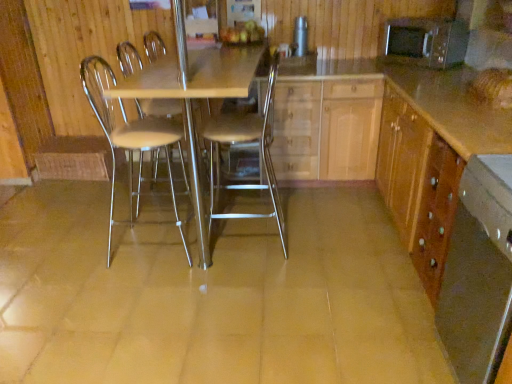
This screenshot has height=384, width=512. What do you see at coordinates (300, 37) in the screenshot?
I see `metallic cylindrical container at upper center, the second appliance in the right-to-left sequence` at bounding box center [300, 37].

The width and height of the screenshot is (512, 384). Find the location of `wooden cabinet at right, which is the 1th cabinetry from right to left`. wooden cabinet at right, which is the 1th cabinetry from right to left is located at coordinates (418, 185).

Measure the distance between wooden cabinet at right, the second cabinetry viewed from the left, and camera.

wooden cabinet at right, the second cabinetry viewed from the left, is 4.85 feet away from camera.

In order to face wooden drawer at lower right, should I rotate leftwards or rightwards?

A 31.709 degree turn to the right will do.

Identify the location of metallic silver chair at center, the 2th chair when ordered from right to left. The width and height of the screenshot is (512, 384). (129, 139).

Is the position of metallic/transparent table at center more distant than that of light wood/texture cabinet at center, placed as the first cabinetry when sorted from left to right?

No, the depth of metallic/transparent table at center is less than that of light wood/texture cabinet at center, placed as the first cabinetry when sorted from left to right.

Can you confirm if metallic/transparent table at center is thinner than light wood/texture cabinet at center, placed as the first cabinetry when sorted from left to right?

In fact, metallic/transparent table at center might be wider than light wood/texture cabinet at center, placed as the first cabinetry when sorted from left to right.

Which of these two, metallic/transparent table at center or light wood/texture cabinet at center, placed as the first cabinetry when sorted from left to right, stands shorter?

With less height is light wood/texture cabinet at center, placed as the first cabinetry when sorted from left to right.

Can you tell me how much metallic/transparent table at center and light wood/texture cabinet at center, placed as the first cabinetry when sorted from left to right, differ in facing direction?

0.166 degrees.

In the scene shown: Is light wood/texture cabinet at center, acting as the 2th cabinetry starting from the right, at the back of metallic microwave at upper right, the 1th appliance positioned from the right?

That's not correct — metallic microwave at upper right, the 1th appliance positioned from the right, is not looking away from light wood/texture cabinet at center, acting as the 2th cabinetry starting from the right.

Considering the positions of point (436, 68) and point (319, 163), is point (436, 68) closer or farther from the camera than point (319, 163)?

Point (436, 68) is closer to the camera than point (319, 163).

From the image's perspective, is metallic microwave at upper right, acting as the 2th appliance starting from the left, located above light wood/texture cabinet at center, acting as the 2th cabinetry starting from the right?

Yes, from the image's perspective, metallic microwave at upper right, acting as the 2th appliance starting from the left, is above light wood/texture cabinet at center, acting as the 2th cabinetry starting from the right.

Is metallic cylindrical container at upper center, the second appliance in the right-to-left sequence, oriented towards light wood/texture cabinet at center, placed as the first cabinetry when sorted from left to right?

No.

Can you confirm if metallic cylindrical container at upper center, the 1th appliance in the left-to-right sequence, is positioned to the left of light wood/texture cabinet at center, acting as the 2th cabinetry starting from the right?

Correct, you'll find metallic cylindrical container at upper center, the 1th appliance in the left-to-right sequence, to the left of light wood/texture cabinet at center, acting as the 2th cabinetry starting from the right.

How many degrees apart are the facing directions of metallic cylindrical container at upper center, the 1th appliance in the left-to-right sequence, and light wood/texture cabinet at center, placed as the first cabinetry when sorted from left to right?

A: The angular difference between metallic cylindrical container at upper center, the 1th appliance in the left-to-right sequence, and light wood/texture cabinet at center, placed as the first cabinetry when sorted from left to right, is 4.5 degrees.

Between metallic microwave at upper right, acting as the 2th appliance starting from the left, and metallic cylindrical container at upper center, the second appliance in the right-to-left sequence, which one is positioned behind?

metallic cylindrical container at upper center, the second appliance in the right-to-left sequence, is more distant.

Would you consider metallic microwave at upper right, the 1th appliance positioned from the right, to be distant from metallic cylindrical container at upper center, the second appliance in the right-to-left sequence?

Actually, metallic microwave at upper right, the 1th appliance positioned from the right, and metallic cylindrical container at upper center, the second appliance in the right-to-left sequence, are a little close together.

Is metallic microwave at upper right, the 1th appliance positioned from the right, taller or shorter than metallic cylindrical container at upper center, the 1th appliance in the left-to-right sequence?

Clearly, metallic microwave at upper right, the 1th appliance positioned from the right, is taller compared to metallic cylindrical container at upper center, the 1th appliance in the left-to-right sequence.

From a real-world perspective, between metallic microwave at upper right, acting as the 2th appliance starting from the left, and metallic cylindrical container at upper center, the second appliance in the right-to-left sequence, who is vertically higher?

In real-world perspective, metallic cylindrical container at upper center, the second appliance in the right-to-left sequence, is above.

Is metallic silver chair at center, which is counted as the first chair, starting from the right, wider or thinner than metallic microwave at upper right, the 1th appliance positioned from the right?

Clearly, metallic silver chair at center, which is counted as the first chair, starting from the right, has more width compared to metallic microwave at upper right, the 1th appliance positioned from the right.

Can you confirm if metallic silver chair at center, which is counted as the first chair, starting from the right, is smaller than metallic microwave at upper right, the 1th appliance positioned from the right?

No, metallic silver chair at center, which is counted as the first chair, starting from the right, is not smaller than metallic microwave at upper right, the 1th appliance positioned from the right.

Who is shorter, metallic silver chair at center, the second chair when ordered from left to right, or metallic microwave at upper right, the 1th appliance positioned from the right?

Standing shorter between the two is metallic microwave at upper right, the 1th appliance positioned from the right.

Is metallic silver chair at center, which is counted as the first chair, starting from the right, not close to metallic microwave at upper right, acting as the 2th appliance starting from the left?

Yes, metallic silver chair at center, which is counted as the first chair, starting from the right, is far from metallic microwave at upper right, acting as the 2th appliance starting from the left.

Can you tell me how much wooden cabinet at right, which is the 1th cabinetry from right to left, and metallic silver chair at center, which appears as the 1th chair when viewed from the left, differ in facing direction?

They differ by 178 degrees in their facing directions.

In the image, is wooden cabinet at right, which is the 1th cabinetry from right to left, on the left side or the right side of metallic silver chair at center, which appears as the 1th chair when viewed from the left?

Clearly, wooden cabinet at right, which is the 1th cabinetry from right to left, is on the right of metallic silver chair at center, which appears as the 1th chair when viewed from the left, in the image.

Is wooden cabinet at right, the second cabinetry viewed from the left, facing towards metallic silver chair at center, the 2th chair when ordered from right to left?

Yes.

Who is shorter, metallic silver chair at center, the 2th chair when ordered from right to left, or light wood/texture cabinet at center, acting as the 2th cabinetry starting from the right?

light wood/texture cabinet at center, acting as the 2th cabinetry starting from the right.

Could you tell me if metallic silver chair at center, which appears as the 1th chair when viewed from the left, is facing light wood/texture cabinet at center, placed as the first cabinetry when sorted from left to right?

No, metallic silver chair at center, which appears as the 1th chair when viewed from the left, is not facing towards light wood/texture cabinet at center, placed as the first cabinetry when sorted from left to right.

Does metallic silver chair at center, the 2th chair when ordered from right to left, lie behind light wood/texture cabinet at center, acting as the 2th cabinetry starting from the right?

No, metallic silver chair at center, the 2th chair when ordered from right to left, is in front of light wood/texture cabinet at center, acting as the 2th cabinetry starting from the right.

From the metallic/transparent table at center, count 1st cabinetry to the right and point to it. Please provide its 2D coordinates.

[(326, 129)]

Find the location of a particular element. Image resolution: width=512 pixels, height=384 pixels. cabinetry that appears behind the metallic microwave at upper right, acting as the 2th appliance starting from the left is located at coordinates (326, 129).

From the image, which object appears to be nearer to metallic silver chair at center, which is counted as the first chair, starting from the right, light wood/texture cabinet at center, placed as the first cabinetry when sorted from left to right, or wooden cabinet at right, which is the 1th cabinetry from right to left?

Among the two, light wood/texture cabinet at center, placed as the first cabinetry when sorted from left to right, is located nearer to metallic silver chair at center, which is counted as the first chair, starting from the right.

Estimate the real-world distances between objects in this image. Which object is further from metallic silver chair at center, which appears as the 1th chair when viewed from the left, wooden drawer at lower right or metallic microwave at upper right, the 1th appliance positioned from the right?

The object further to metallic silver chair at center, which appears as the 1th chair when viewed from the left, is metallic microwave at upper right, the 1th appliance positioned from the right.

From the image, which object appears to be farther from metallic silver chair at center, the 2th chair when ordered from right to left, metallic/transparent table at center or metallic silver chair at center, which is counted as the first chair, starting from the right?

metallic silver chair at center, which is counted as the first chair, starting from the right, is further to metallic silver chair at center, the 2th chair when ordered from right to left.

Which object lies further to the anchor point light wood/texture cabinet at center, acting as the 2th cabinetry starting from the right, metallic cylindrical container at upper center, the second appliance in the right-to-left sequence, or metallic silver chair at center, which appears as the 1th chair when viewed from the left?

metallic silver chair at center, which appears as the 1th chair when viewed from the left.

Estimate the real-world distances between objects in this image. Which object is closer to metallic silver chair at center, the 2th chair when ordered from right to left, wooden cabinet at right, the second cabinetry viewed from the left, or light wood/texture cabinet at center, acting as the 2th cabinetry starting from the right?

light wood/texture cabinet at center, acting as the 2th cabinetry starting from the right, is closer to metallic silver chair at center, the 2th chair when ordered from right to left.

Based on their spatial positions, is wooden drawer at lower right or light wood/texture cabinet at center, placed as the first cabinetry when sorted from left to right, closer to metallic microwave at upper right, the 1th appliance positioned from the right?

light wood/texture cabinet at center, placed as the first cabinetry when sorted from left to right.

When comparing their distances from light wood/texture cabinet at center, placed as the first cabinetry when sorted from left to right, does metallic/transparent table at center or metallic silver chair at center, which appears as the 1th chair when viewed from the left, seem closer?

metallic/transparent table at center.

Looking at the image, which one is located further to metallic/transparent table at center, metallic silver chair at center, the second chair when ordered from left to right, or wooden cabinet at right, the second cabinetry viewed from the left?

Based on the image, wooden cabinet at right, the second cabinetry viewed from the left, appears to be further to metallic/transparent table at center.

Locate an element on the screen. This screenshot has height=384, width=512. chair situated between metallic silver chair at center, the 2th chair when ordered from right to left, and light wood/texture cabinet at center, placed as the first cabinetry when sorted from left to right, from left to right is located at coordinates (246, 143).

The height and width of the screenshot is (384, 512). Find the location of `appliance between metallic silver chair at center, the second chair when ordered from left to right, and metallic microwave at upper right, acting as the 2th appliance starting from the left, in the horizontal direction`. appliance between metallic silver chair at center, the second chair when ordered from left to right, and metallic microwave at upper right, acting as the 2th appliance starting from the left, in the horizontal direction is located at coordinates (300, 37).

At what (x,y) coordinates should I click in order to perform the action: click on chair located between metallic silver chair at center, which appears as the 1th chair when viewed from the left, and wooden drawer at lower right in the left-right direction. Please return your answer as a coordinate pair (x, y). This screenshot has height=384, width=512. Looking at the image, I should click on (246, 143).

Where is `appliance between wooden drawer at lower right and metallic cylindrical container at upper center, the second appliance in the right-to-left sequence, along the z-axis`? appliance between wooden drawer at lower right and metallic cylindrical container at upper center, the second appliance in the right-to-left sequence, along the z-axis is located at coordinates (425, 42).